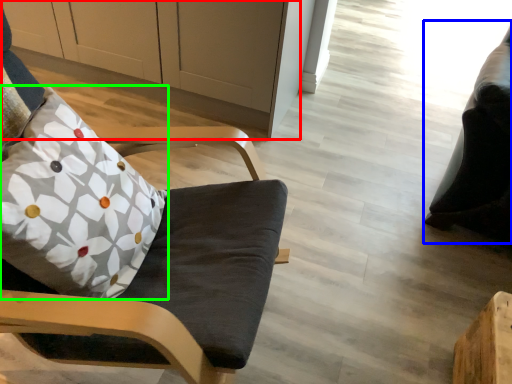
Question: Estimate the real-world distances between objects in this image. Which object is closer to cabinetry (highlighted by a red box), bean bag chair (highlighted by a blue box) or pillow (highlighted by a green box)?

Choices:
 (A) bean bag chair
 (B) pillow

Answer: (B)